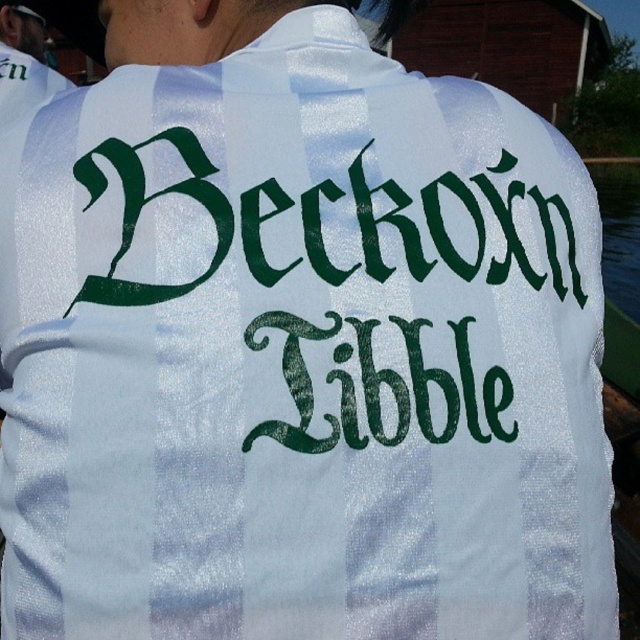
Can you confirm if transparent plastic water at right is bigger than white glossy shirt at upper left?

Yes.

Is transparent plastic water at right to the left of white glossy shirt at upper left from the viewer's perspective?

No, transparent plastic water at right is not to the left of white glossy shirt at upper left.

Which is in front, point (624, 228) or point (12, 115)?

Positioned in front is point (12, 115).

The width and height of the screenshot is (640, 640). In order to click on transparent plastic water at right in this screenshot , I will do `click(620, 228)`.